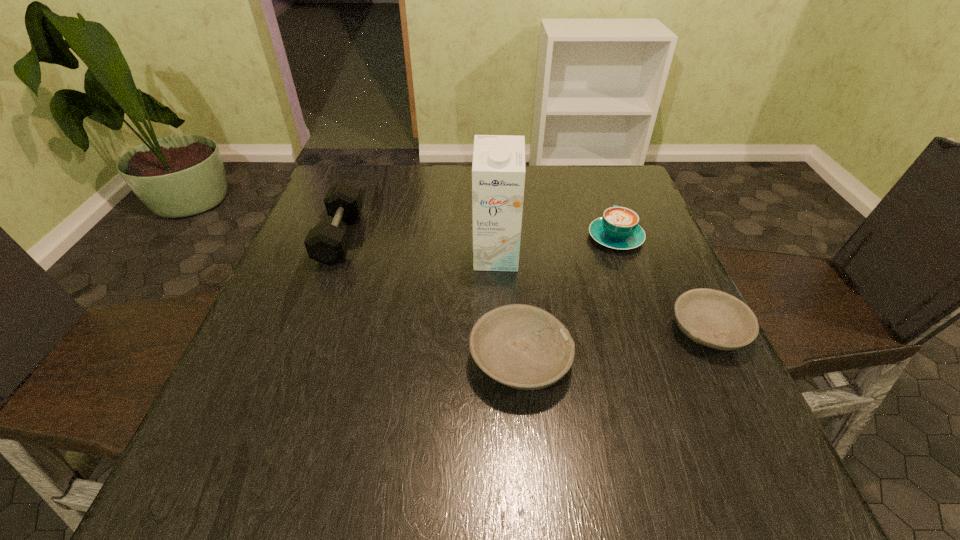
Locate an element on the screen. vacant spot to place a bowl on the left is located at coordinates (307, 395).